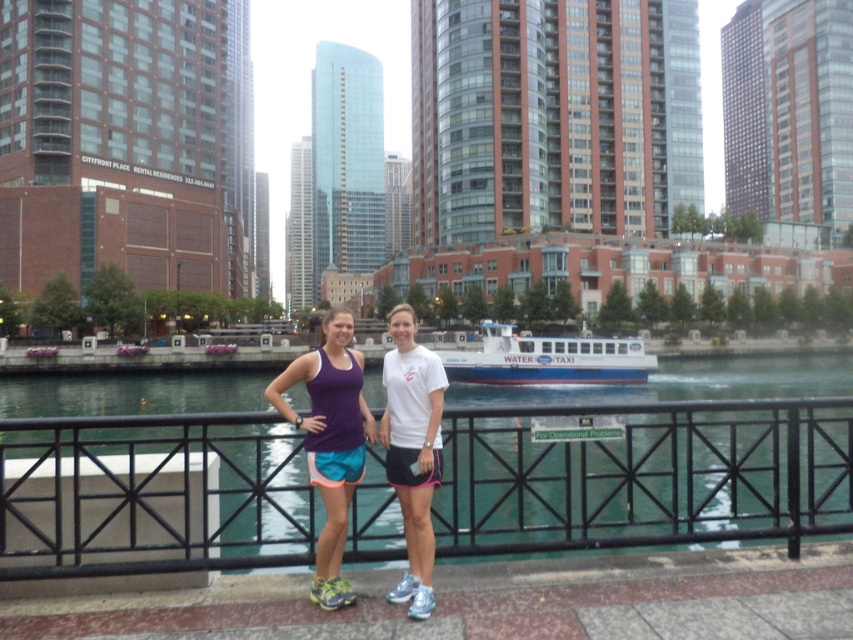
You are a photographer trying to capture the black metal railing at center and the purple fabric tank top at center in the same frame. Which object is wider?

The black metal railing at center is wider than the purple fabric tank top at center.

You are a photographer trying to capture the purple fabric tank top at center. You notice a point at coordinates (329,440). Is this point located on the purple fabric tank top at center?

Yes, the point at coordinates (329,440) is located on the purple fabric tank top at center according to the description.

You are standing at the point with coordinates point (334, 472) and want to walk towards the point with coordinates point (16, 499). According to the scene, will you be moving forward or backward?

Point (16, 499) is behind point (334, 472), so moving towards it would mean moving backward.